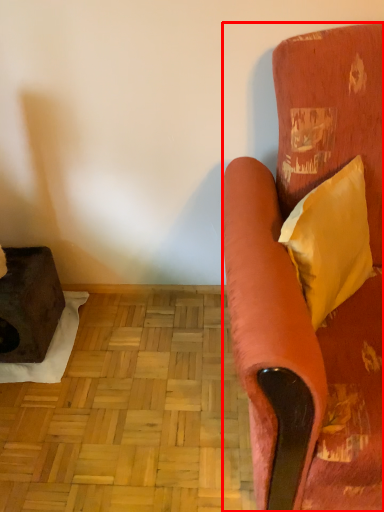
Question: From the image's perspective, where is studio couch (annotated by the red box) located relative to pillow?

Choices:
 (A) above
 (B) below

Answer: (B)